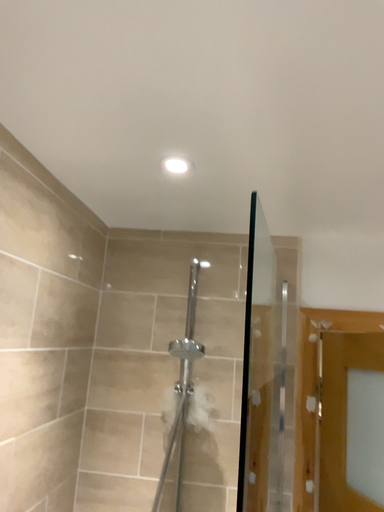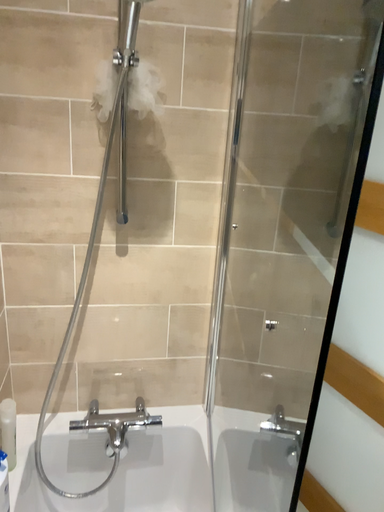
Question: Which way did the camera rotate in the video?

Choices:
 (A) rotated downward
 (B) rotated upward

Answer: (A)